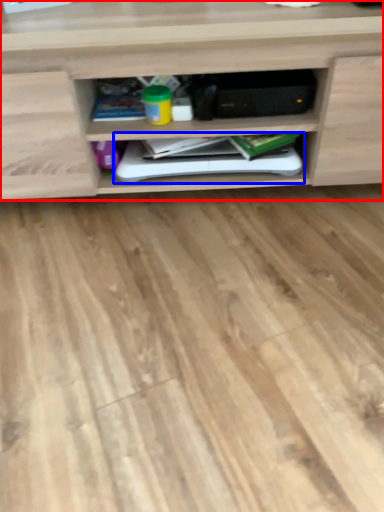
Question: Among these objects, which one is farthest to the camera, shelf (highlighted by a red box) or book (highlighted by a blue box)?

Choices:
 (A) shelf
 (B) book

Answer: (B)